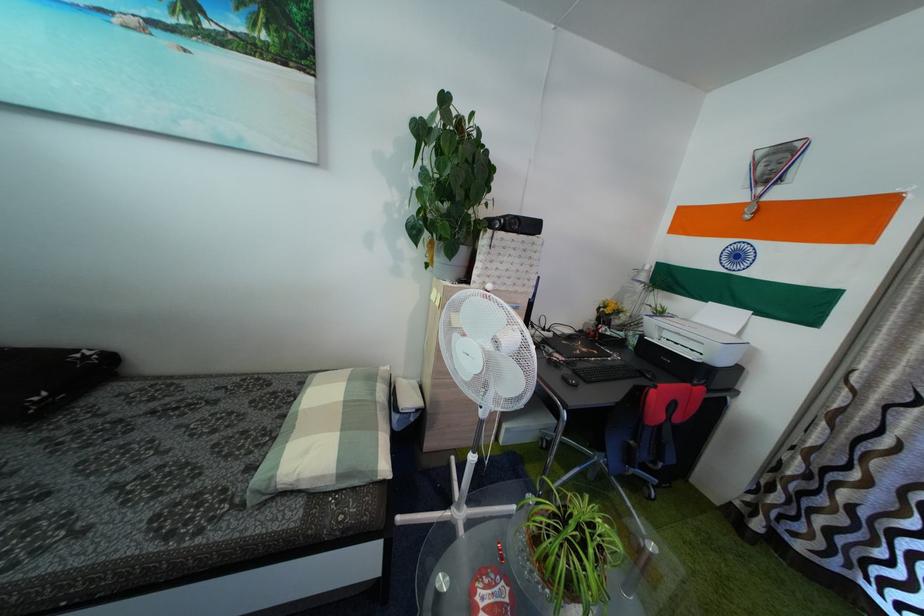
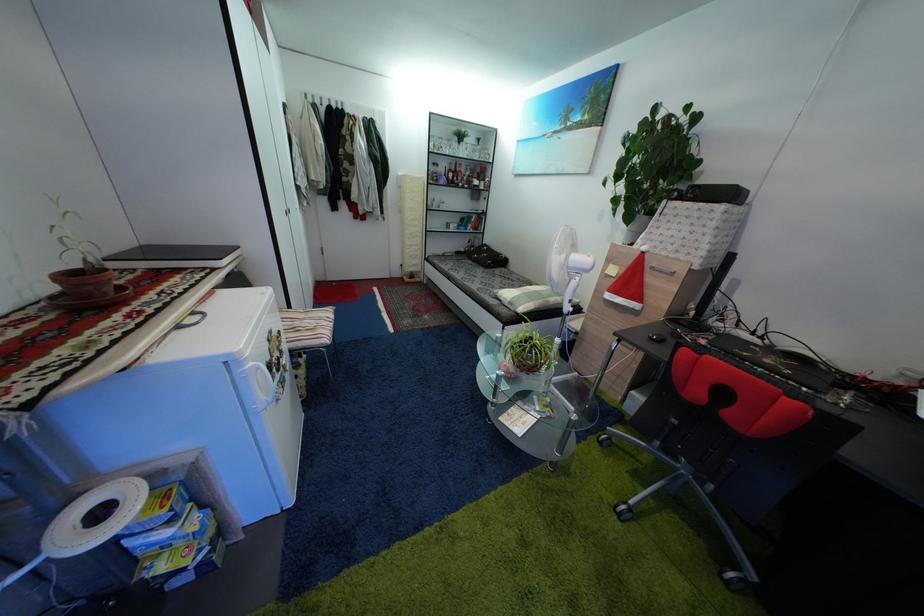
In the second image, find the point that corresponds to pixel 347 483 in the first image.

(517, 310)